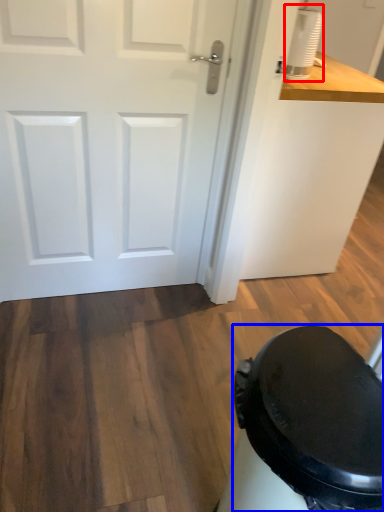
Question: Which object is further to the camera taking this photo, appliance (highlighted by a red box) or potty (highlighted by a blue box)?

Choices:
 (A) appliance
 (B) potty

Answer: (A)